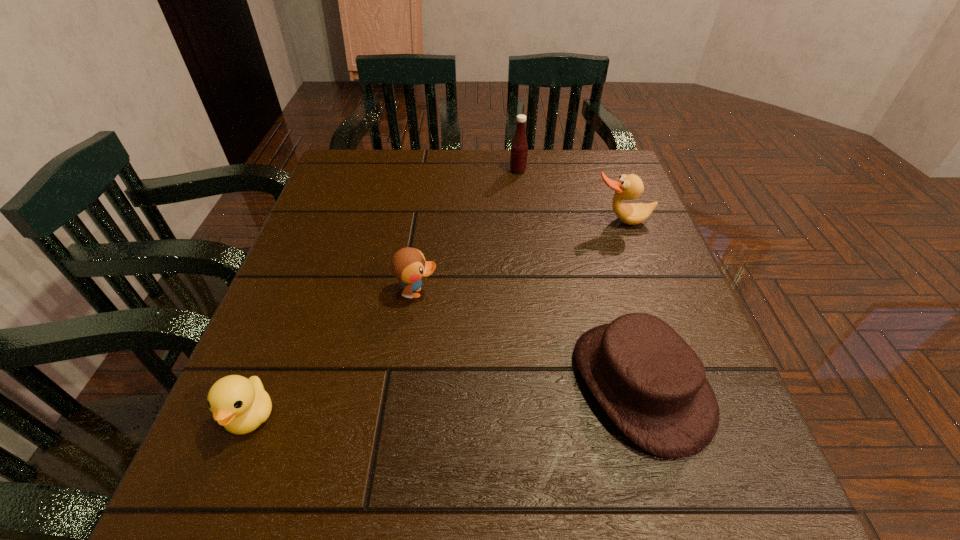
Image resolution: width=960 pixels, height=540 pixels. I want to click on free space that satisfies the following two spatial constraints: 1. on the front-facing side of the third nearest object; 2. on the face of the leftmost object, so click(x=400, y=416).